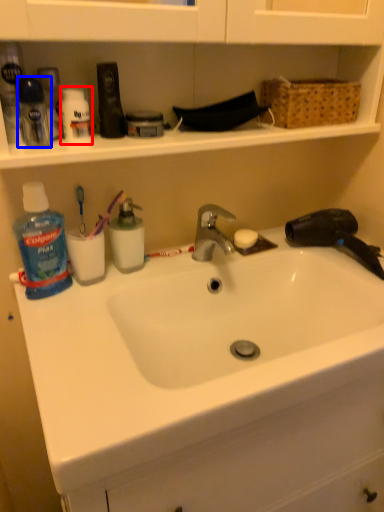
Question: Which object is further to the camera taking this photo, toiletry (highlighted by a red box) or toiletry (highlighted by a blue box)?

Choices:
 (A) toiletry
 (B) toiletry

Answer: (A)